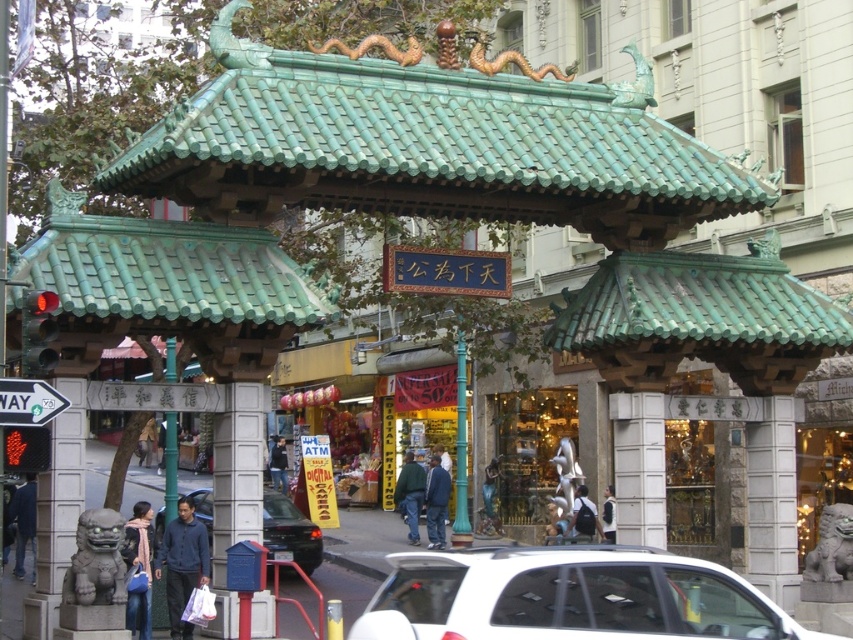
Where is `dark blue shirt at lower left`? dark blue shirt at lower left is located at coordinates (183, 563).

Measure the distance between dark blue shirt at lower left and camera.

44.58 meters

The image size is (853, 640). What are the coordinates of `dark blue shirt at lower left` in the screenshot? It's located at (183, 563).

Does dark blue shirt at lower left have a lesser width compared to green stone pole at center?

Yes.

Is dark blue shirt at lower left below green stone pole at center?

Yes.

You are a GUI agent. You are given a task and a screenshot of the screen. Output one action in this format:
    pyautogui.click(x=<x>, y=<y>)
    Task: Click on the dark blue shirt at lower left
    The height and width of the screenshot is (640, 853).
    Given the screenshot: What is the action you would take?
    pyautogui.click(x=183, y=563)

Image resolution: width=853 pixels, height=640 pixels. Find the location of `dark blue shirt at lower left`. dark blue shirt at lower left is located at coordinates (183, 563).

Is point (12, 516) more distant than point (604, 512)?

No.

Between blue denim jacket at lower left and white cotton shirt at center, which one is positioned higher?

blue denim jacket at lower left

Is point (16, 522) farther from viewer compared to point (611, 512)?

No.

Locate an element on the screen. The height and width of the screenshot is (640, 853). blue denim jacket at lower left is located at coordinates (24, 524).